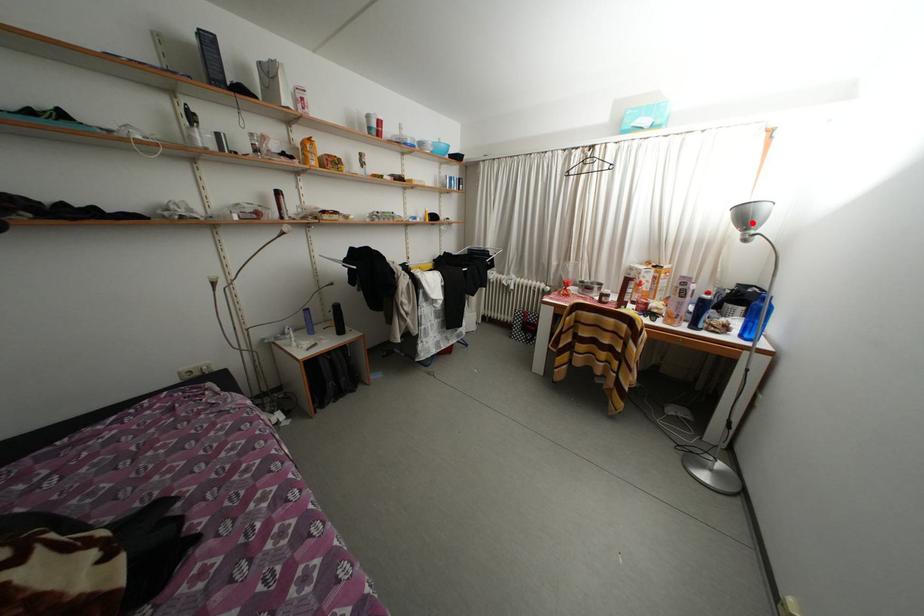
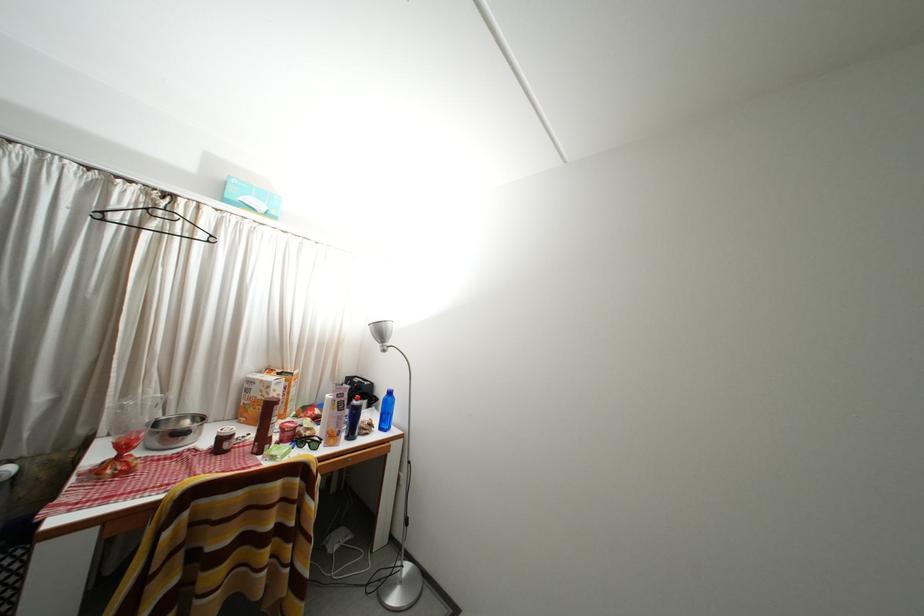
The point at the highlighted location is marked in the first image. Where is the corresponding point in the second image?

(388, 338)